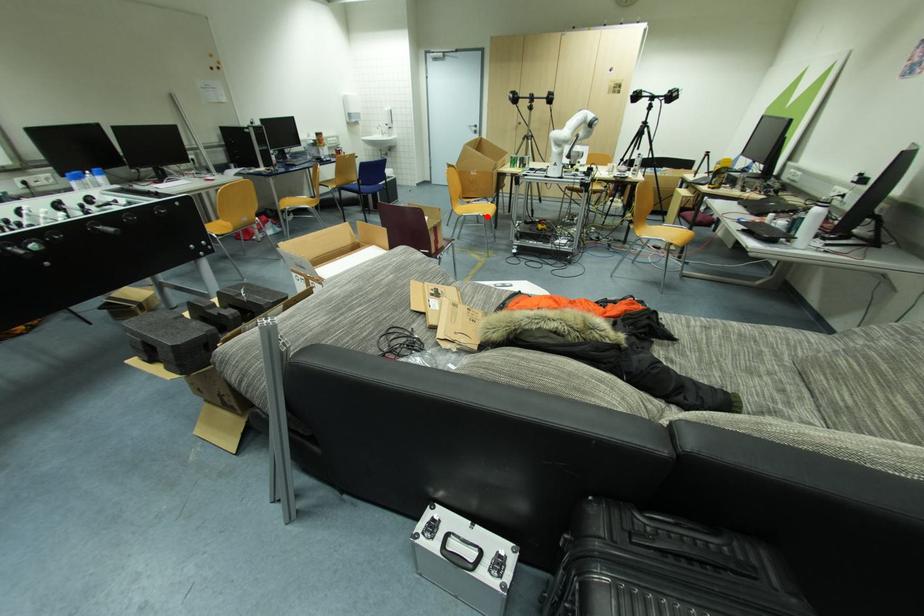
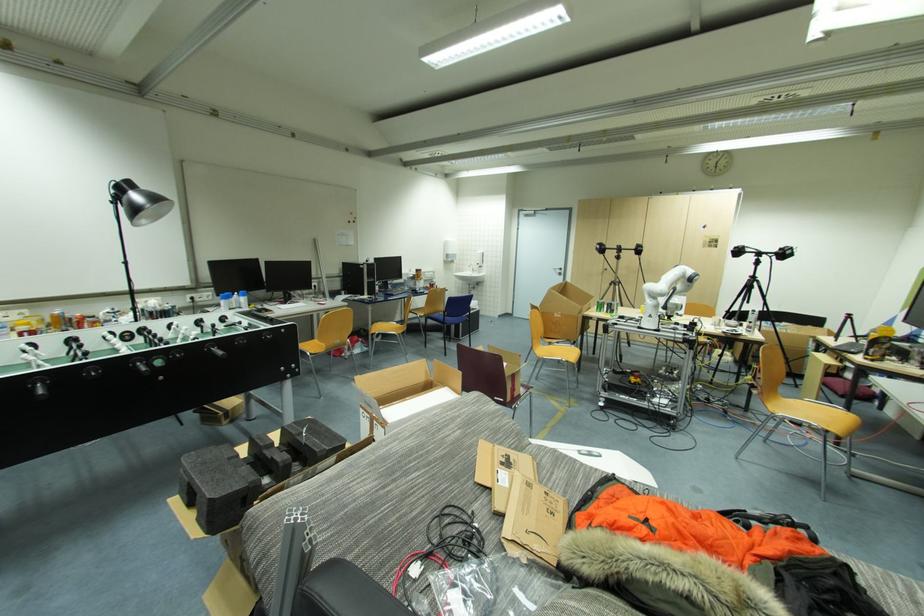
Question: I am providing you with two images of the same scene from different viewpoints. A red point is shown in image1. For the corresponding object point in image2, is it positioned nearer or farther from the camera?

Choices:
 (A) Nearer
 (B) Farther

Answer: (B)